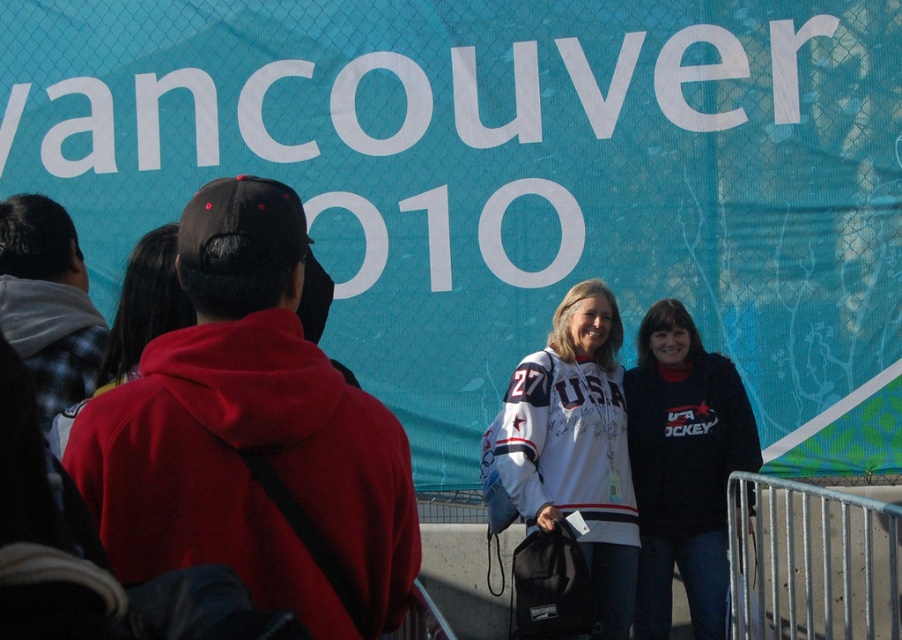
You are a photographer at the event and want to ensure both the white jersey at center and the black fleece sweatshirt at center are clearly visible in your photo. Given their sizes, which one should you focus on first to ensure proper framing?

The white jersey at center is bigger than the black fleece sweatshirt at center, so you should focus on the white jersey at center first to ensure it is properly framed in the photo.